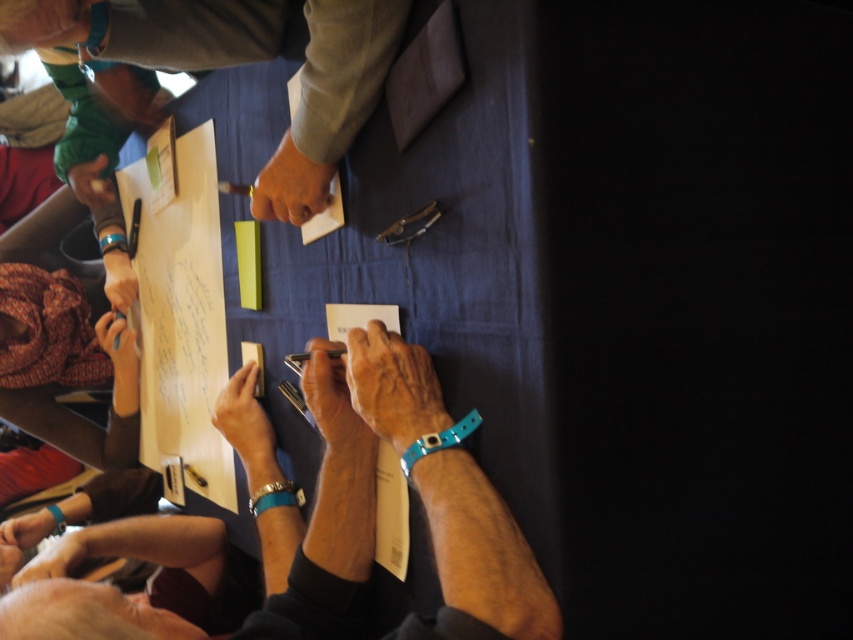
Does matte black pen at upper center have a greater width compared to smooth black pen at lower left?

Yes, matte black pen at upper center is wider than smooth black pen at lower left.

Is point (286, 140) closer to viewer compared to point (254, 440)?

Yes, it is in front of point (254, 440).

Who is more distant from viewer, (281, 216) or (256, 436)?

The point (256, 436) is more distant.

Identify the location of matte black pen at upper center. (289, 186).

Who is positioned more to the right, yellow paper at center or matte black pen at lower left?

Positioned to the right is yellow paper at center.

Consider the image. How far apart are yellow paper at center and matte black pen at lower left?

yellow paper at center and matte black pen at lower left are 7.12 inches apart from each other.

Which is behind, point (192, 410) or point (106, 337)?

The point (106, 337) is more distant.

Locate an element on the screen. yellow paper at center is located at coordinates (187, 340).

Consider the image. Is matte black pen at upper center smaller than smooth skin hand at lower left?

No.

Which is below, matte black pen at upper center or smooth skin hand at lower left?

smooth skin hand at lower left is below.

Does point (285, 156) lie behind point (9, 525)?

No, (285, 156) is in front of (9, 525).

Locate an element on the screen. Image resolution: width=853 pixels, height=640 pixels. matte black pen at upper center is located at coordinates (289, 186).